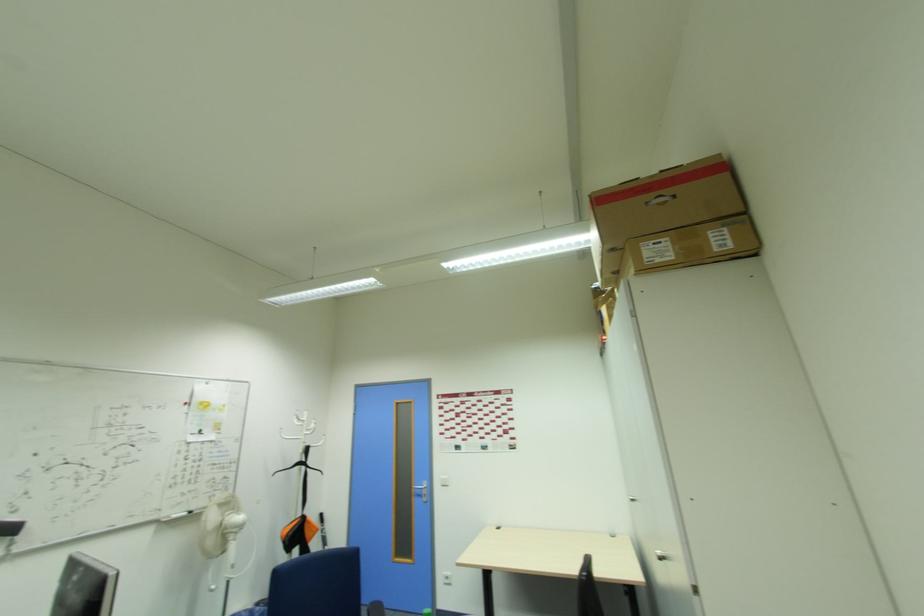
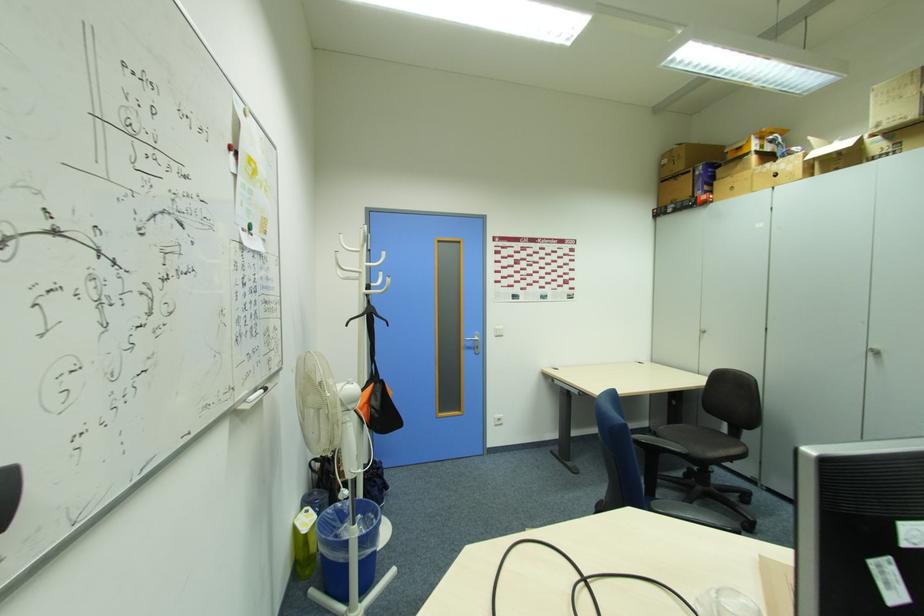
In the second image, find the point that corresponds to point (420, 493) in the first image.

(472, 346)